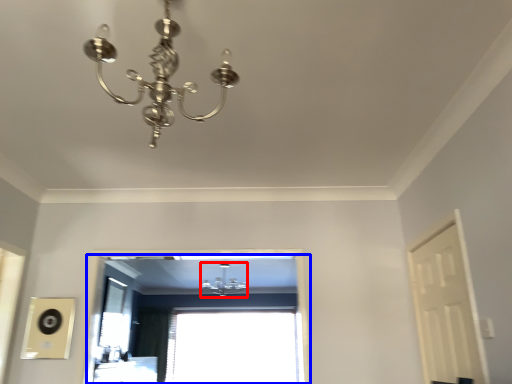
Question: Among these objects, which one is farthest to the camera, lamp (highlighted by a red box) or window (highlighted by a blue box)?

Choices:
 (A) lamp
 (B) window

Answer: (A)